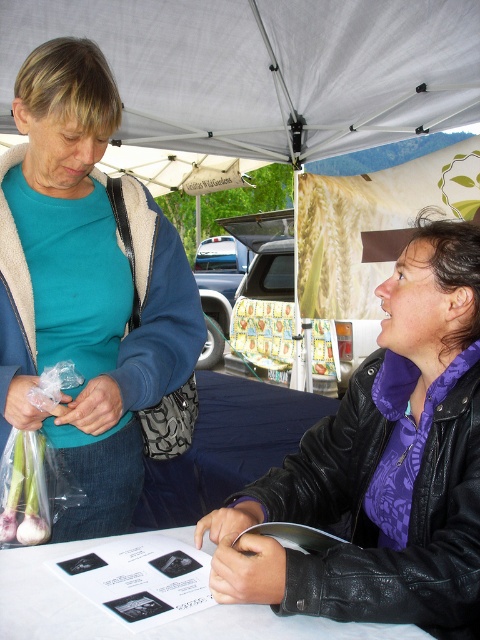
Where is the purple leather jacket at center located in the image?

The purple leather jacket at center is located at point 0.730 on the x axis and 0.800 on the y axis.

You are a delivery robot with a height of 1.5 meters. You need to pass under the white fabric canopy at upper center while avoiding the purple leather jacket at center. Is there enough vertical clearance for you to pass under the canopy without hitting the jacket?

The distance between the purple leather jacket at center and the white fabric canopy at upper center is 2.31 meters. Since the robot is 1.5 meters tall, there is sufficient vertical clearance for the robot to pass under the canopy without hitting the jacket.

You are a photographer at the market and want to take a portrait of both the matte teal shirt at left and the white paper at center. Which object should you focus on first if you want to ensure both are in sharp focus?

The matte teal shirt at left is thinner than the white paper at center, so you should focus on the white paper at center first to ensure both are in sharp focus.